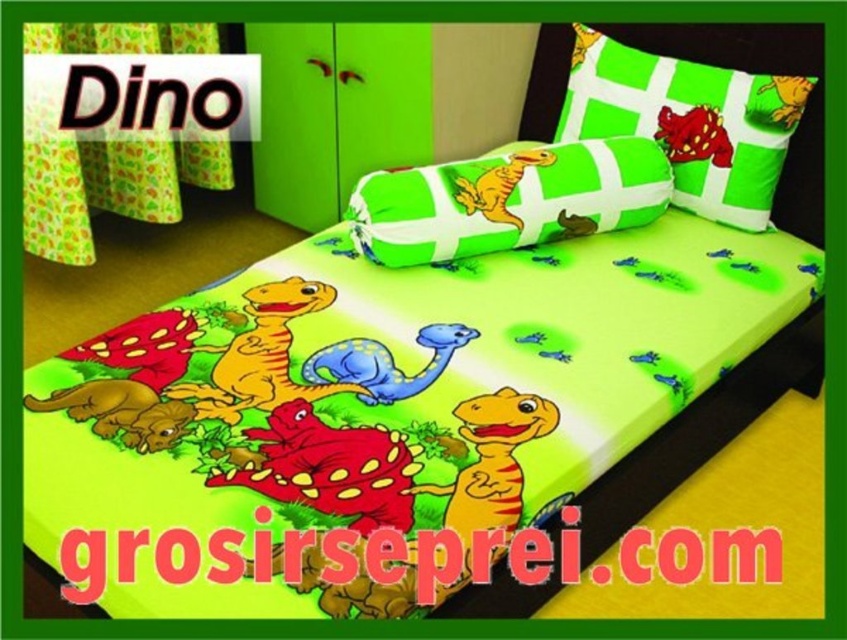
You are standing in the childrens bedroom and see two points marked on the wall. The first point is at point (142,404) and the second is at point (479,177). Which point is closer to you?

Point (142,404) is in front of point (479,177), so it is closer to you.

You are a parent trying to arrange toys in the childrens bedroom. You have a blue rubber dinosaur at center and a brown matte dinosaur at lower left. You want to place a new toy box between them. What is the minimum width the toy box should be to fit between them without touching either dinosaur?

The blue rubber dinosaur at center is 17.80 inches from the brown matte dinosaur at lower left. To fit between them without touching, the toy box should be at least 17.80 inches wide.